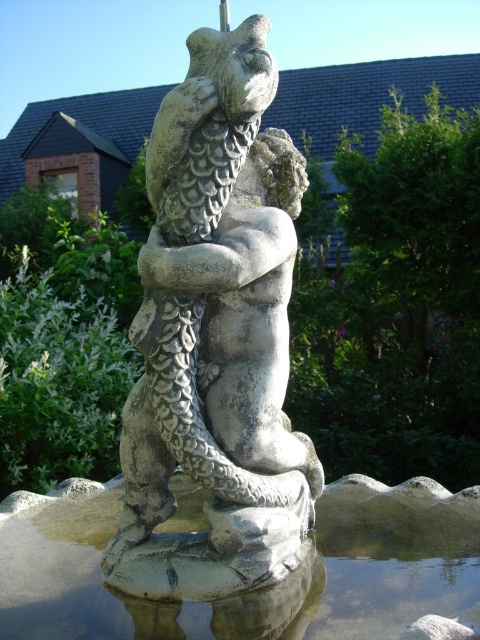
You are an artist planning to create a miniature model of the sculpture and its base. Given the spatial relationship between the gray stone statue at center and the clear stone water at center, which one should you scale down more to maintain the original proportions?

The gray stone statue at center occupies less space than the clear stone water at center, so to maintain the original proportions, the gray stone statue at center should be scaled down more than the clear stone water at center.

You are standing in front of a garden sculpture that has a human figure and a fish. There is a specific point at coordinates (216, 339). What object is located at that point?

The point at coordinates (216, 339) corresponds to the gray stone statue at center.

You are standing at the center of a garden and see the gray stone statue at center. If you walk 0.1 units north, will you be closer to the statue?

Yes, walking 0.1 units north from the center will bring you closer to the gray stone statue at center located at point [216,339].